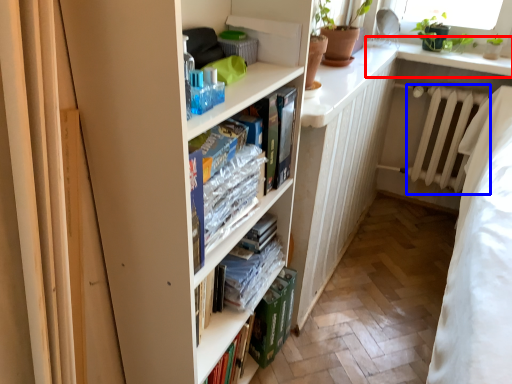
Question: Which point is further to the camera, window sill (highlighted by a red box) or radiator (highlighted by a blue box)?

Choices:
 (A) window sill
 (B) radiator

Answer: (B)